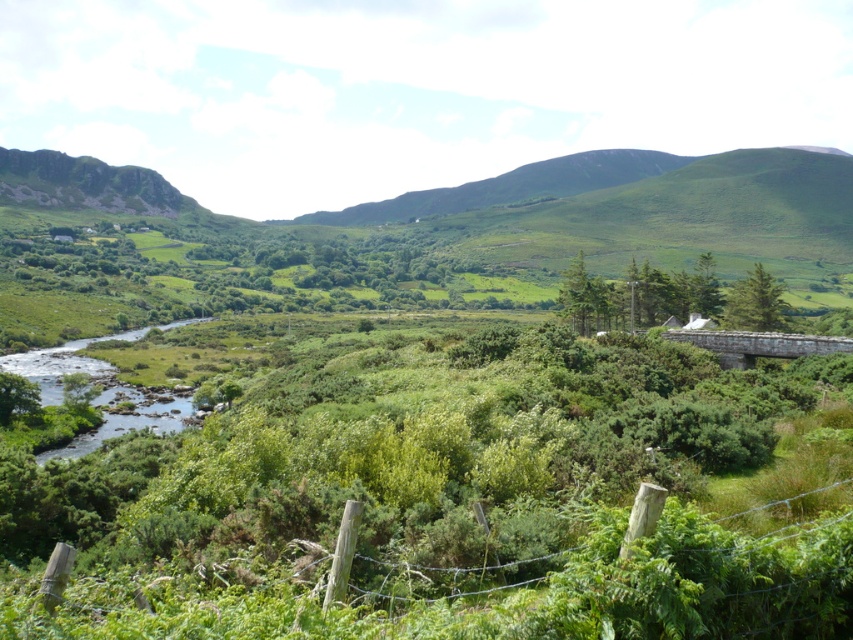
You are a landscape architect planning to plant new trees in the rural area shown. You have two types of trees available, the green leafy tree at right and the green matte tree at center. If you want to plant a tree that takes up more horizontal space, which one should you choose?

The green leafy tree at right should be chosen because its width surpasses that of the green matte tree at center, making it the better option for taking up more horizontal space.

You are an environmental scientist assessing the health of the trees in the rural landscape. You observe the green leafy tree at center and the green matte tree at center. Which tree appears to be more robust in terms of size?

The green leafy tree at center appears to be more robust in terms of size as it has a larger size compared to the green matte tree at center.

Consider the image. You are standing in the rural landscape and see two green leafy trees. Which tree, the green leafy tree at center or the green leafy tree at right, is located more to the left side of the scene?

The green leafy tree at center is positioned on the left side of the green leafy tree at right, so the green leafy tree at center is located more to the left side of the scene.